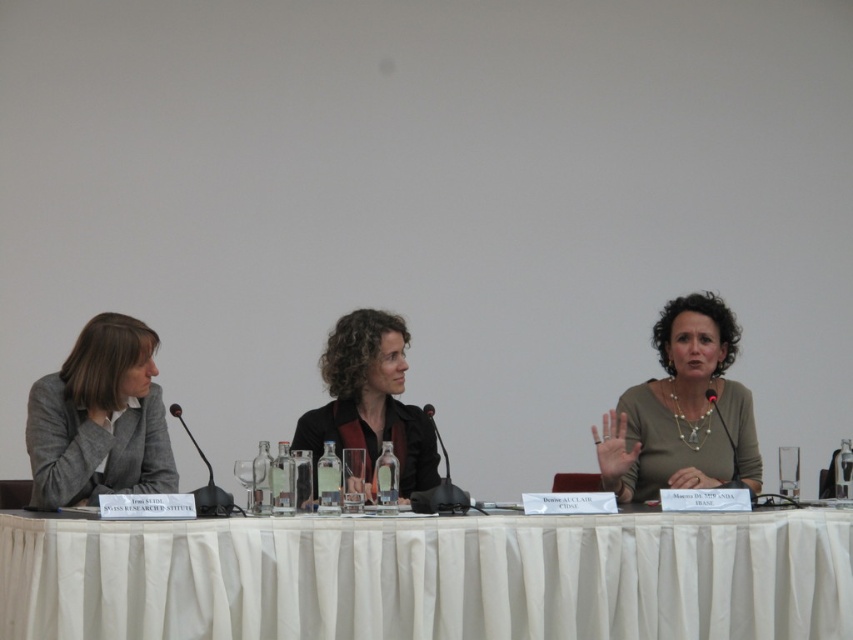
Question: Does white cloth at center appear over black plastic microphone at center?

Choices:
 (A) no
 (B) yes

Answer: (A)

Question: Which object is farther from the camera taking this photo?

Choices:
 (A) matte black jacket at center
 (B) black plastic microphone at center
 (C) gray woolen blazer at left

Answer: (A)

Question: Which object is the closest to the gray woolen blazer at left?

Choices:
 (A) matte black jacket at center
 (B) black plastic microphone at center
 (C) white cloth at center

Answer: (B)

Question: In this image, where is white cloth at center located relative to matte beige blouse at center?

Choices:
 (A) above
 (B) below

Answer: (B)

Question: Which point is closer to the camera?

Choices:
 (A) matte beige blouse at center
 (B) white cloth at center

Answer: (B)

Question: Is matte beige blouse at center bigger than matte black jacket at center?

Choices:
 (A) yes
 (B) no

Answer: (B)